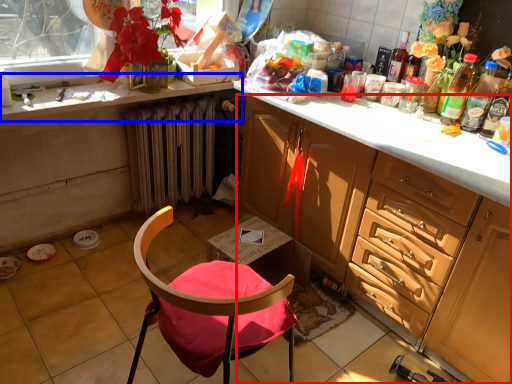
Question: Which object appears farthest to the camera in this image, cabinetry (highlighted by a red box) or countertop (highlighted by a blue box)?

Choices:
 (A) cabinetry
 (B) countertop

Answer: (B)